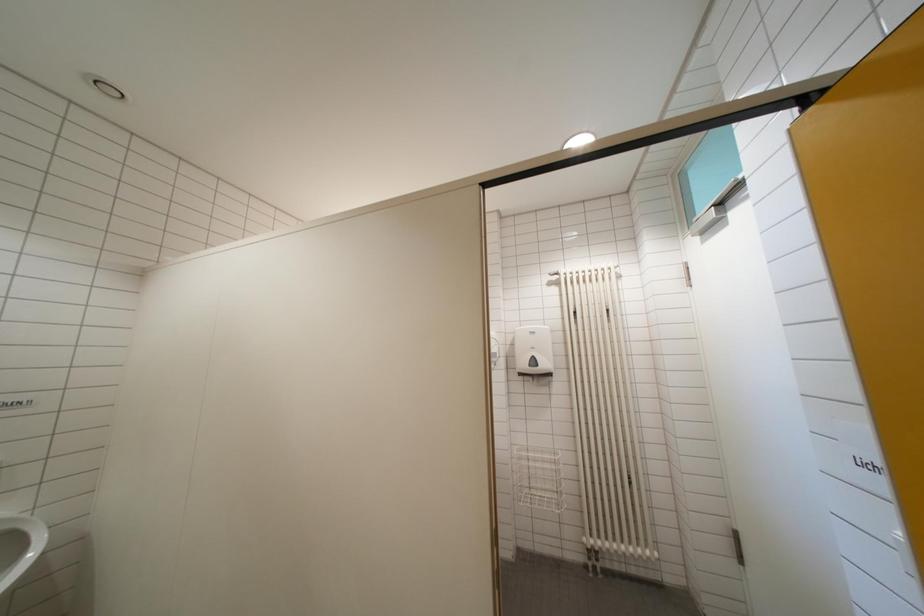
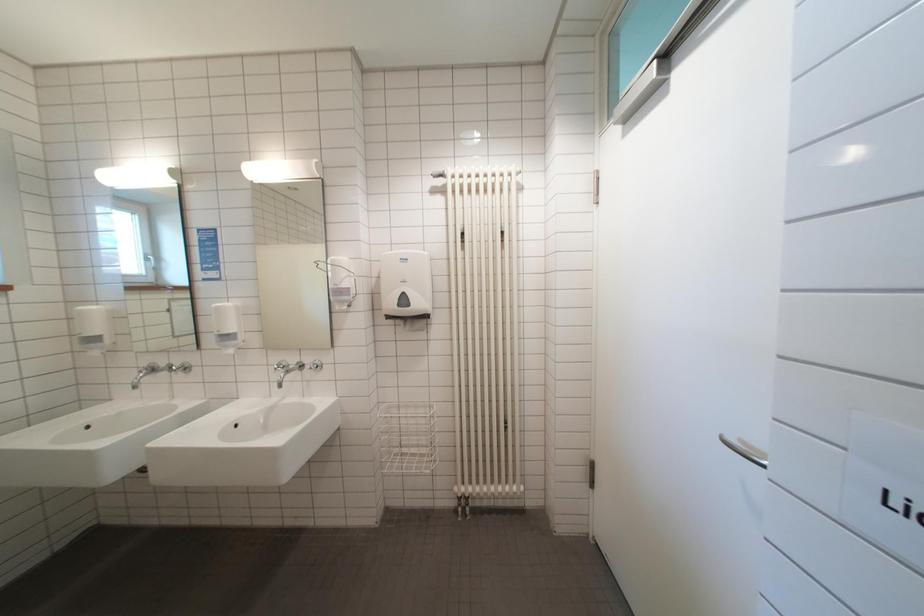
The images are taken continuously from a first-person perspective. In which direction are you moving?

The movement direction of the cameraman is right, forward.